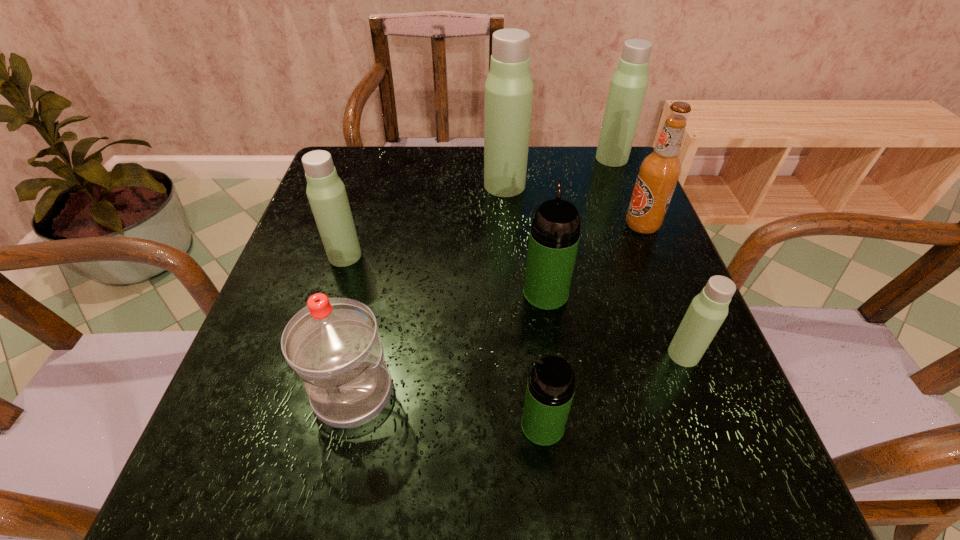
Identify the location of the smallest light thermos bottle. (708, 310).

What are the coordinates of `the nearest light thermos bottle` in the screenshot? It's located at pyautogui.click(x=708, y=310).

Identify the location of the smaller green thermos bottle. This screenshot has width=960, height=540. (550, 389).

I want to click on the nearer green thermos bottle, so click(550, 389).

The height and width of the screenshot is (540, 960). Identify the location of vacant point located 0.100m on the front of the biggest light thermos bottle. (507, 223).

This screenshot has width=960, height=540. In order to click on vacant space located 0.280m on the left of the second biggest light thermos bottle in this screenshot , I will do `click(494, 158)`.

I want to click on vacant area situated on the front label of the beer bottle, so click(585, 226).

Locate an element on the screen. The width and height of the screenshot is (960, 540). free point located on the front label of the beer bottle is located at coordinates (516, 226).

The width and height of the screenshot is (960, 540). What are the coordinates of `free location located 0.260m on the front label of the beer bottle` in the screenshot? It's located at [512, 226].

Locate an element on the screen. free region located 0.230m from the spout of the bigger green thermos bottle is located at coordinates (534, 208).